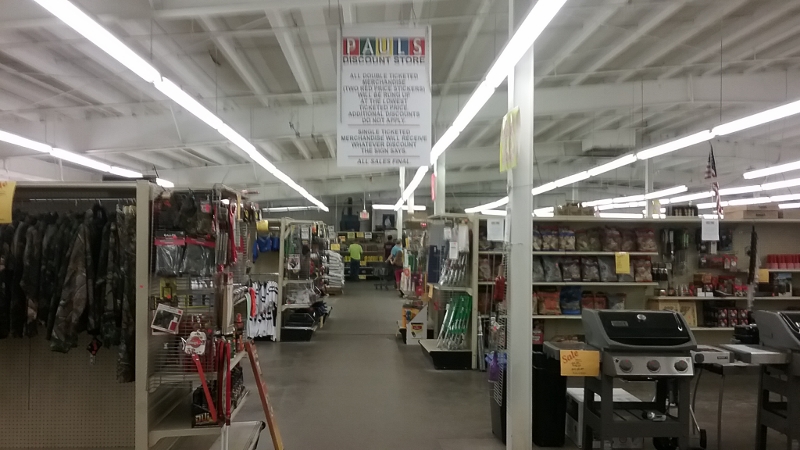
At what (x,y) coordinates should I click in order to perform the action: click on fluorescent lights. Please return your answer as a coordinate pair (x, y). This screenshot has height=450, width=800. Looking at the image, I should click on (180, 103), (97, 39), (242, 144), (285, 182).